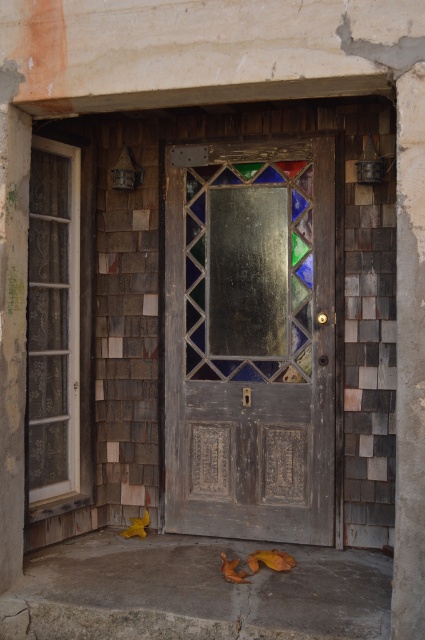
You are an interior designer assessing the dimensions of the stained glass door at center and the stained glass panel at center in the image. Which one is taller?

The stained glass door at center is taller than the stained glass panel at center.

You are standing in front of a rustic doorway and see the stained glass panel at center and the clear glass window at left. Which one is positioned to the right side of the other?

The stained glass panel at center is to the right of clear glass window at left.

You are an interior designer assessing the door and its components. You need to determine which object has a greater width between the stained glass panel at center and the clear glass window at left. Based on the scene, which one is wider?

The stained glass panel at center has a greater width than the clear glass window at left, as stated in the description that its width surpasses the latter.